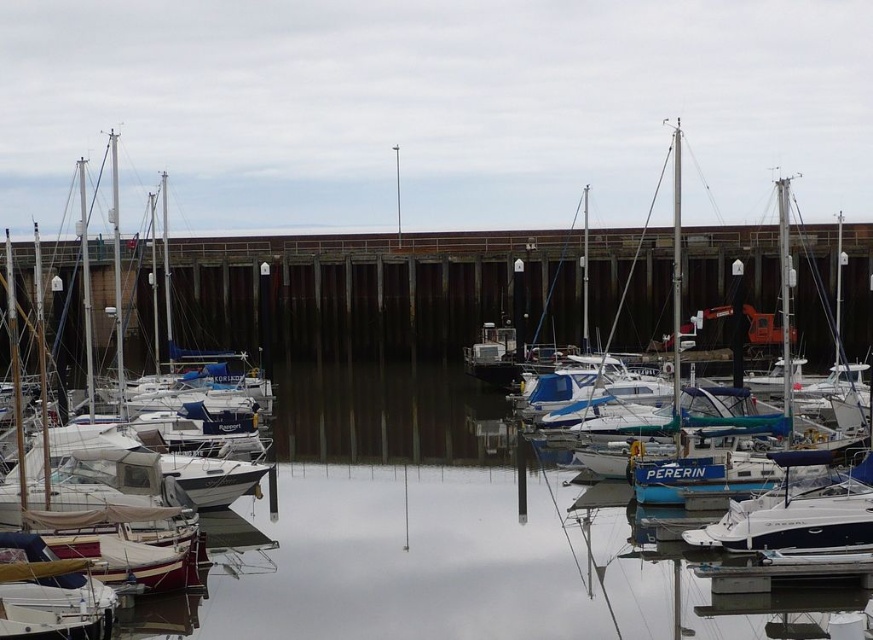
Question: Among these objects, which one is farthest from the camera?

Choices:
 (A) blue glossy sailboat at center
 (B) white matte sailboat at left

Answer: (A)

Question: Does white matte sailboat at left have a greater width compared to blue glossy sailboat at center?

Choices:
 (A) yes
 (B) no

Answer: (A)

Question: Can you confirm if white matte sailboat at left is bigger than blue glossy sailboat at center?

Choices:
 (A) yes
 (B) no

Answer: (A)

Question: Is white matte sailboat at left smaller than blue glossy sailboat at center?

Choices:
 (A) no
 (B) yes

Answer: (A)

Question: Among these points, which one is nearest to the camera?

Choices:
 (A) (100, 472)
 (B) (789, 410)

Answer: (A)